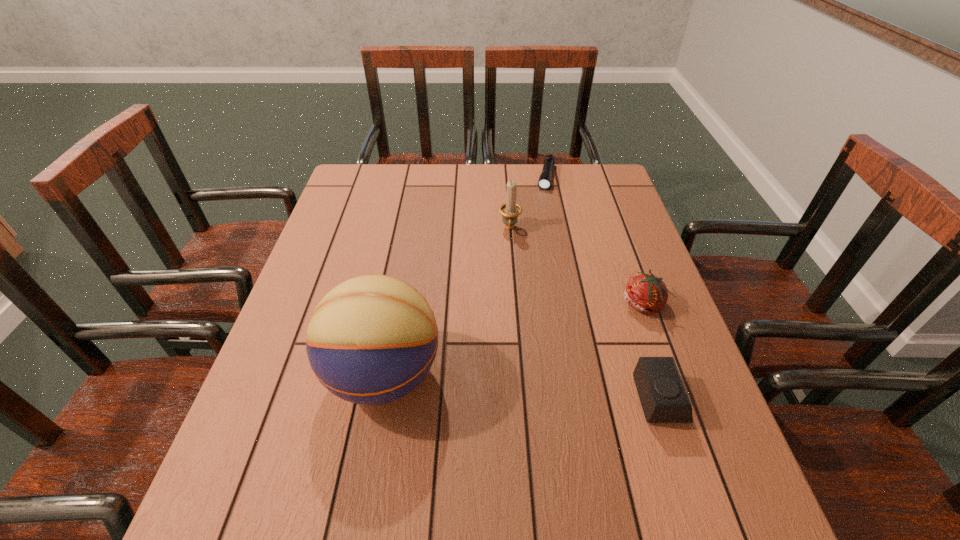
At what (x,y) coordinates should I click in order to perform the action: click on alarm clock present at the near edge. Please return your answer as a coordinate pair (x, y). Looking at the image, I should click on (662, 394).

The image size is (960, 540). Find the location of `object at the left edge`. object at the left edge is located at coordinates (371, 340).

This screenshot has width=960, height=540. Find the location of `alarm clock present at the right edge`. alarm clock present at the right edge is located at coordinates (662, 394).

Locate an element on the screen. tomato that is at the right edge is located at coordinates 646,293.

Locate an element on the screen. The image size is (960, 540). object that is at the near left corner is located at coordinates (371, 340).

Where is `object present at the near right corner`? Image resolution: width=960 pixels, height=540 pixels. object present at the near right corner is located at coordinates (662, 394).

Where is `free location at the far edge of the desktop`? free location at the far edge of the desktop is located at coordinates (479, 182).

The width and height of the screenshot is (960, 540). Find the location of `vacant space at the near edge of the desktop`. vacant space at the near edge of the desktop is located at coordinates (514, 464).

Find the location of a particular element. Image resolution: width=960 pixels, height=540 pixels. free region at the left edge of the desktop is located at coordinates (328, 287).

At what (x,y) coordinates should I click in order to perform the action: click on free space at the right edge. Please return your answer as a coordinate pair (x, y). The height and width of the screenshot is (540, 960). Looking at the image, I should click on (636, 312).